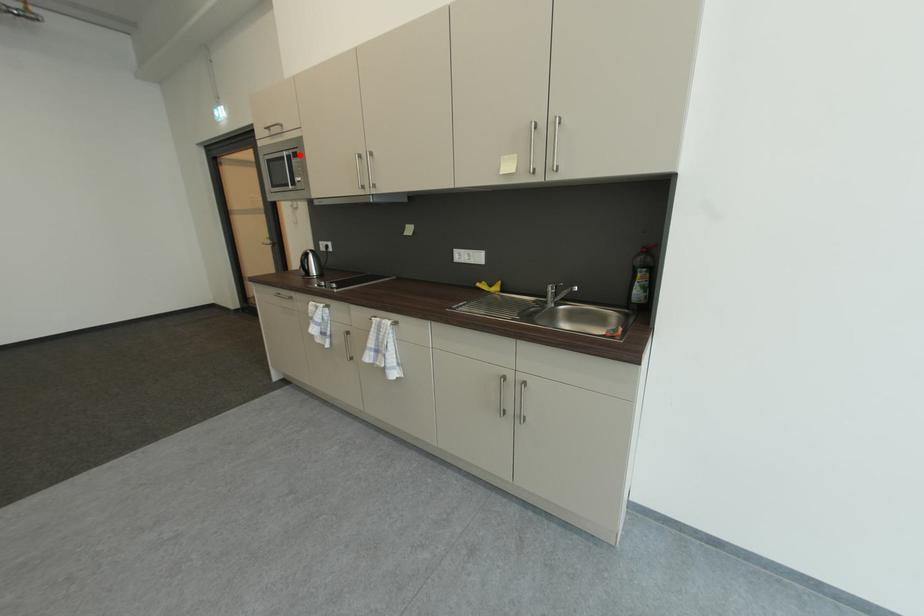
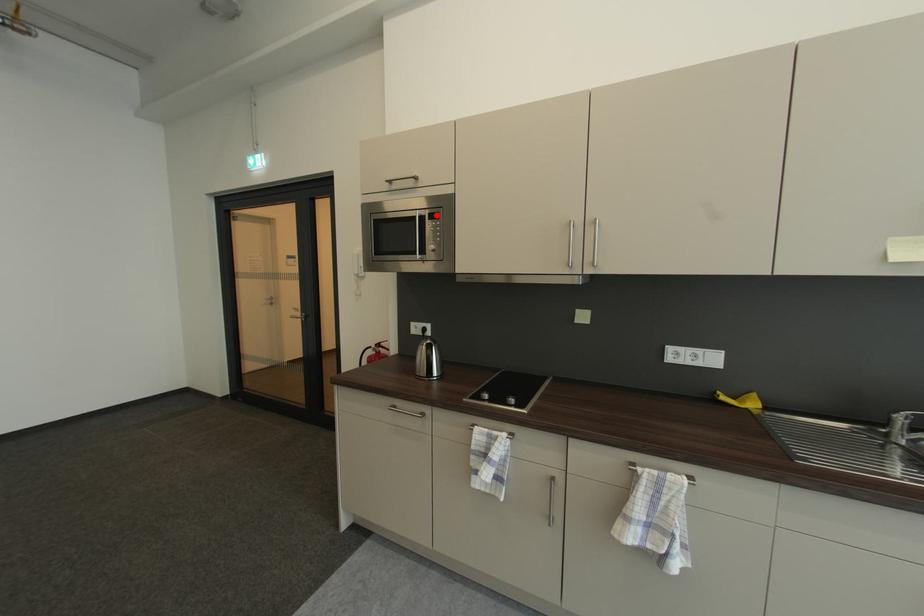
I am providing you with two images of the same scene from different viewpoints. A red point is marked on the first image and another point is marked on the second image. Does the point marked in image1 correspond to the same location as the one in image2?

Yes